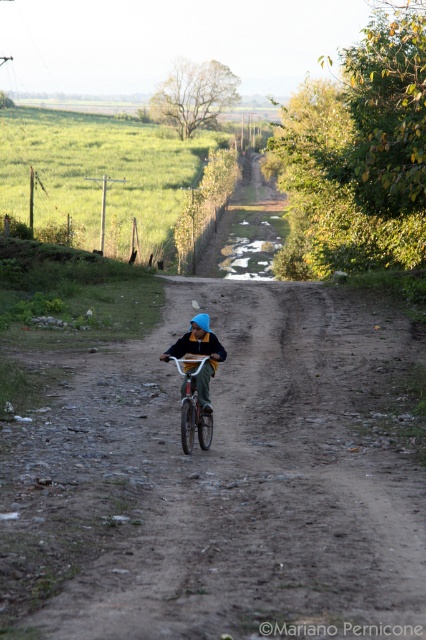
Looking at this image, you are a delivery person trying to deliver a package to the blue fabric helmet at center. Your delivery vehicle is the white matte bicycle at center. Can you safely carry the helmet on the bicycle without it falling off during the ride?

The blue fabric helmet at center is larger in width than the white matte bicycle at center, so it might not fit securely on the bicycle and could fall off during the ride.

You are a delivery drone trying to navigate above the dirt road. The blue fabric helmet at center is in your path. Can you fly over it without hitting the helmet?

The blue fabric helmet at center is located at coordinates point (201,355). Since drones can adjust their flight path, you can safely navigate around it by altering your route slightly to avoid collision.